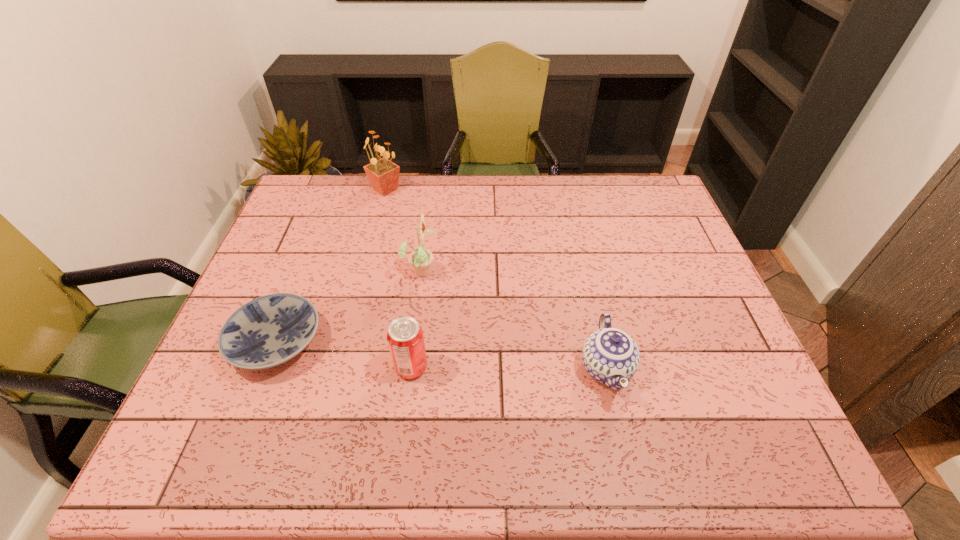
In order to click on the left sunflower in this screenshot , I will do `click(383, 174)`.

This screenshot has width=960, height=540. Find the location of `the farthest object`. the farthest object is located at coordinates (383, 174).

The width and height of the screenshot is (960, 540). I want to click on the fourth nearest object, so click(420, 259).

I want to click on the nearer sunflower, so click(x=420, y=259).

The image size is (960, 540). Find the location of `the third shortest object`. the third shortest object is located at coordinates (405, 338).

I want to click on the rightmost object, so click(x=610, y=356).

I want to click on chinaware, so click(610, 356).

What are the coordinates of `the shortest object` in the screenshot? It's located at (268, 331).

What are the coordinates of `vacant area located 0.390m at the front of the left sunflower with flowers visible` in the screenshot? It's located at (362, 283).

At what (x,y) coordinates should I click in order to perform the action: click on vacant position located 0.140m on the front-facing side of the nearer sunflower. Please return your answer as a coordinate pair (x, y). This screenshot has height=540, width=960. Looking at the image, I should click on (487, 271).